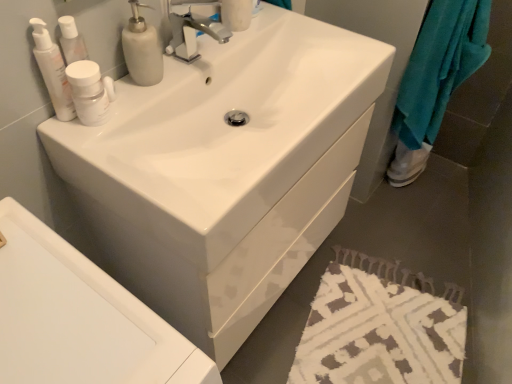
The image size is (512, 384). I want to click on free point in front of white matte soap dispenser at upper left, so click(x=120, y=127).